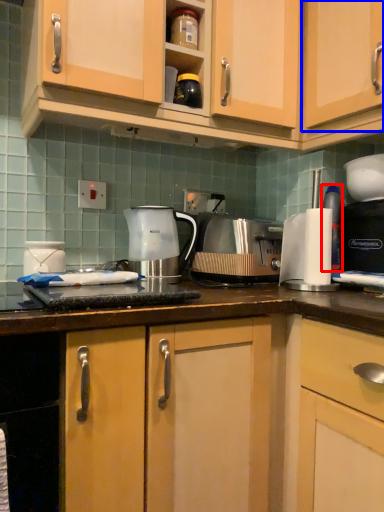
Question: Which point is closer to the camera, bottle (highlighted by a red box) or cabinetry (highlighted by a blue box)?

Choices:
 (A) bottle
 (B) cabinetry

Answer: (B)